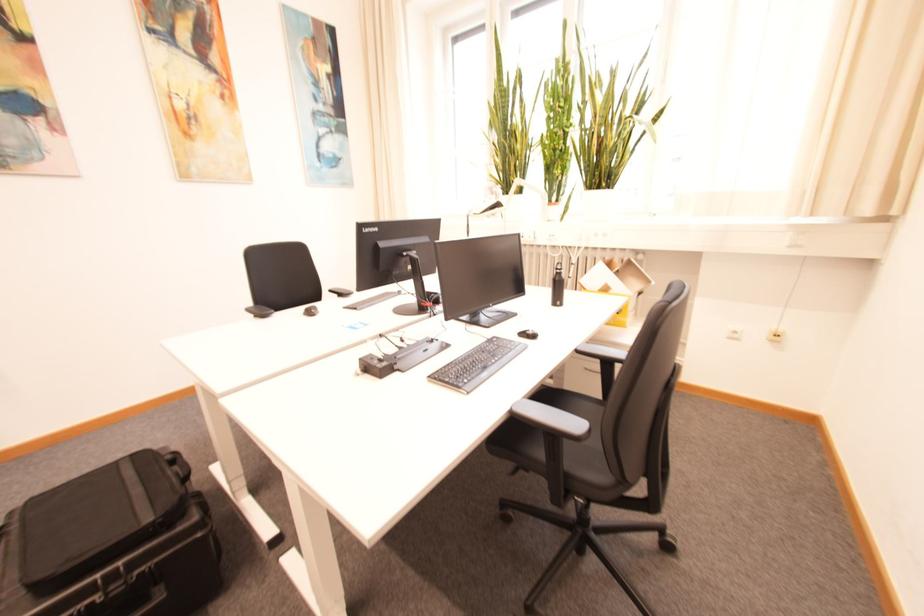
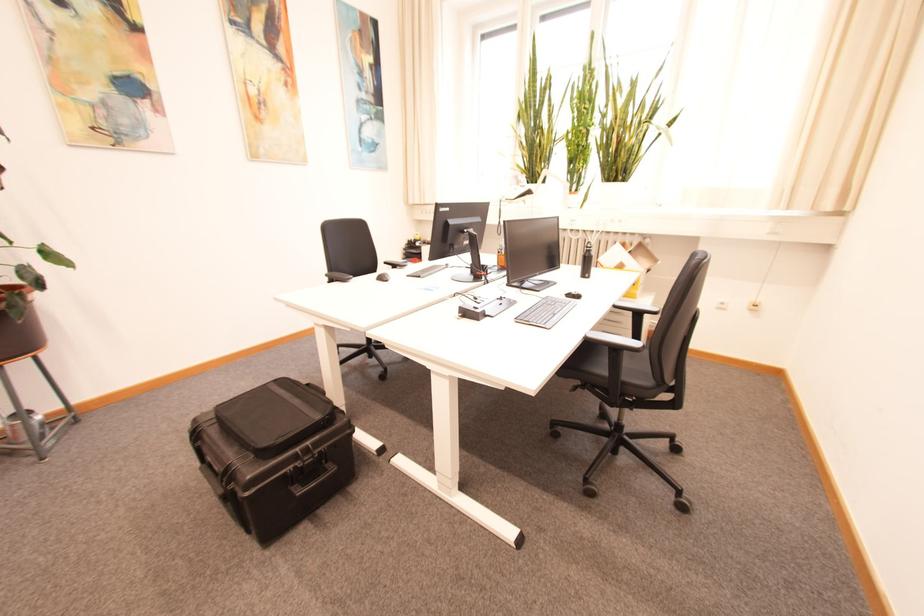
Find the pixel in the second image that matches (584,352) in the first image.

(622, 308)